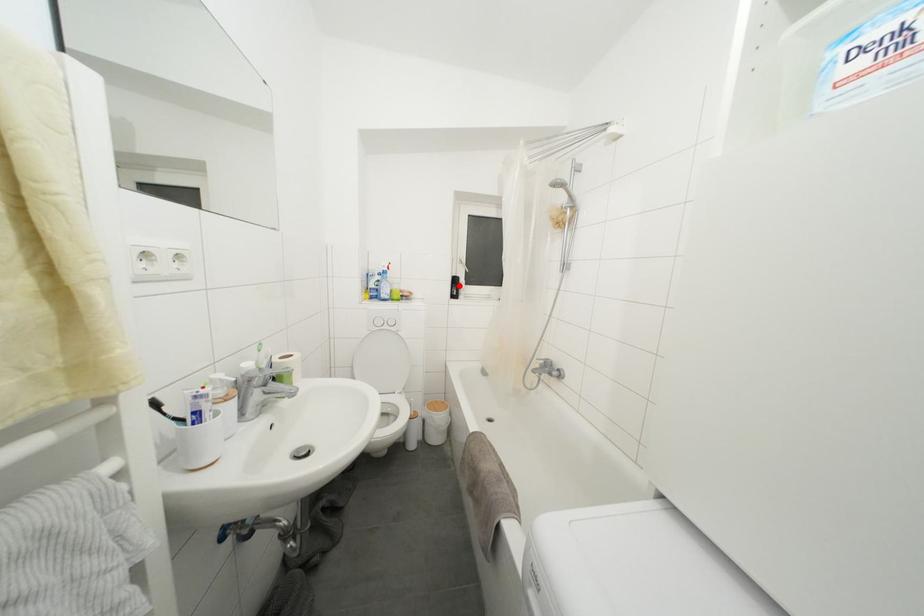
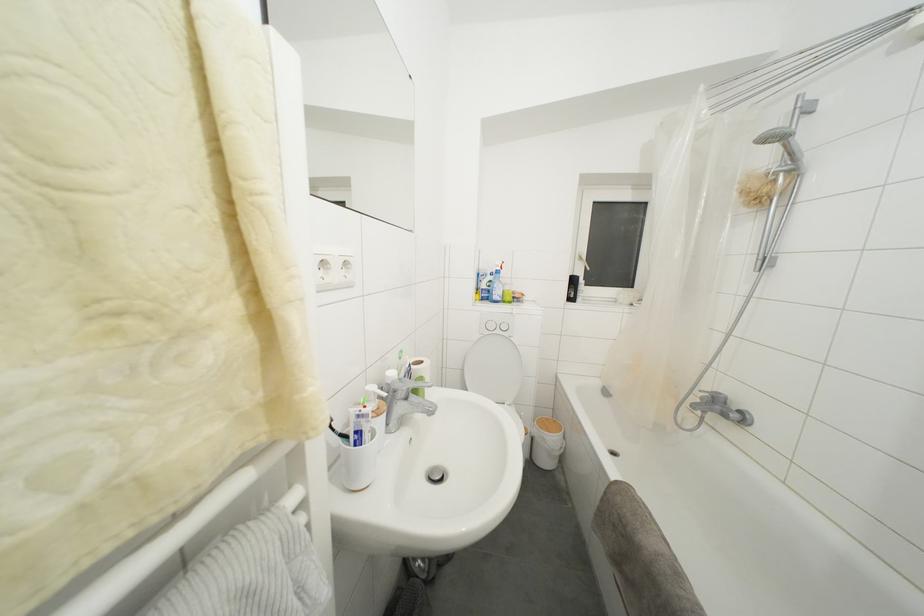
In the second image, find the point that corresponds to the highlighted location in the first image.

(578, 286)